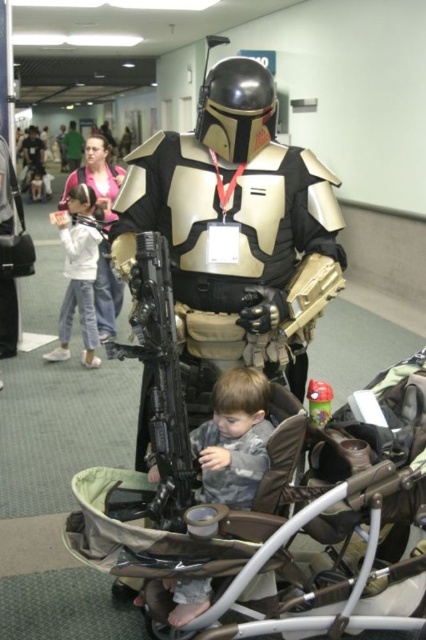
Question: Is metallic gold armor at center above white soft pants at left?

Choices:
 (A) no
 (B) yes

Answer: (A)

Question: Among these points, which one is nearest to the camera?

Choices:
 (A) (250, 486)
 (B) (69, 138)
 (C) (376, 534)
 (D) (69, 333)

Answer: (C)

Question: Which object appears closest to the camera in this image?

Choices:
 (A) gray soft fabric toddler at center
 (B) metallic gold armor at center

Answer: (A)

Question: Where is white soft pants at left located in relation to green fabric shirt at center in the image?

Choices:
 (A) left
 (B) right

Answer: (B)

Question: Can you confirm if metallic gold armor at center is positioned to the right of green fabric shirt at center?

Choices:
 (A) no
 (B) yes

Answer: (B)

Question: Among these objects, which one is farthest from the camera?

Choices:
 (A) gray soft fabric toddler at center
 (B) green fabric shirt at center
 (C) white soft pants at left

Answer: (B)